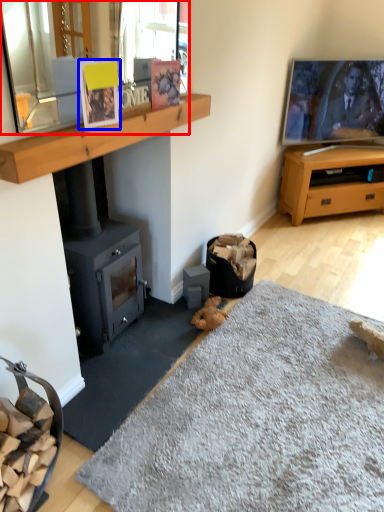
Question: Which of the following is the farthest to the observer, mirror (highlighted by a red box) or picture frame (highlighted by a blue box)?

Choices:
 (A) mirror
 (B) picture frame

Answer: (B)